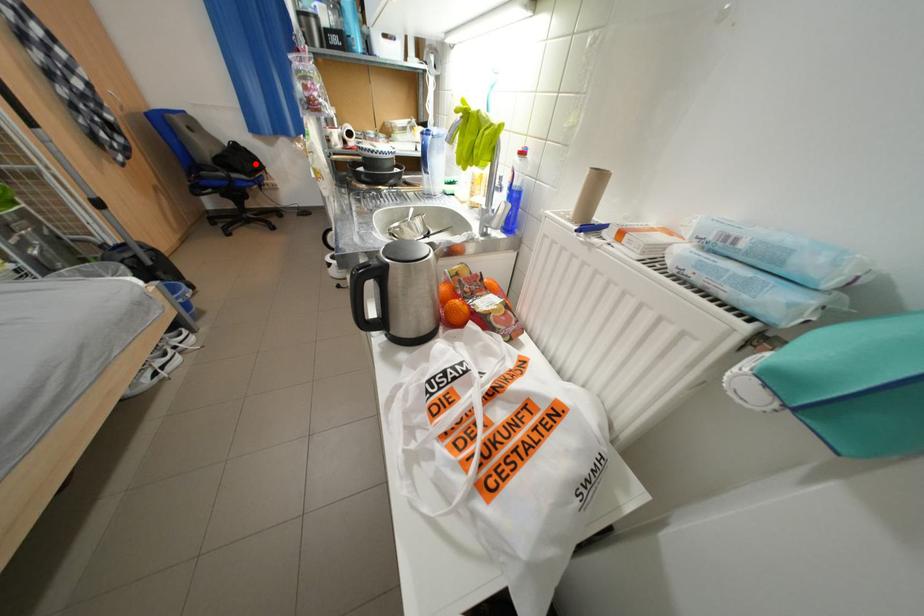
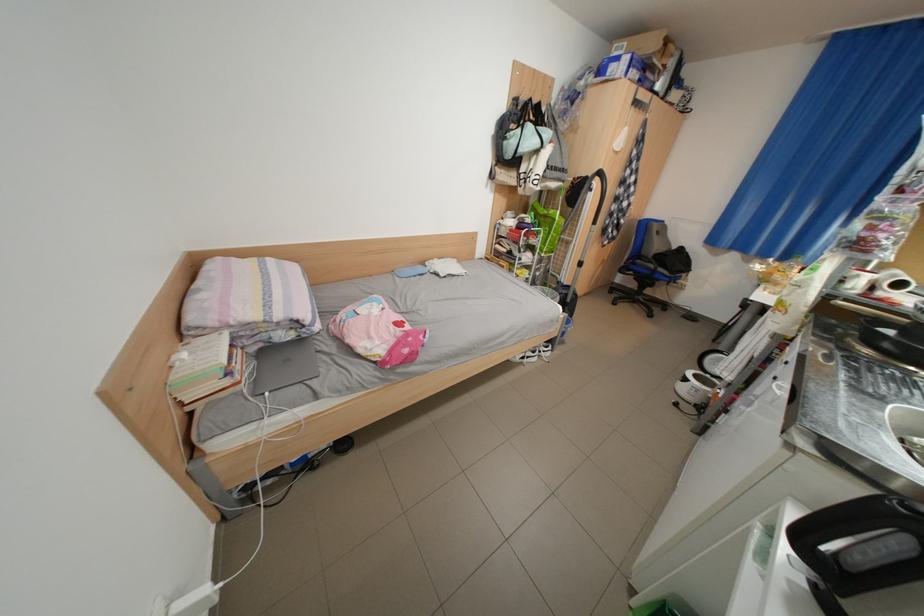
The point at the highlighted location is marked in the first image. Where is the corresponding point in the second image?

(687, 264)